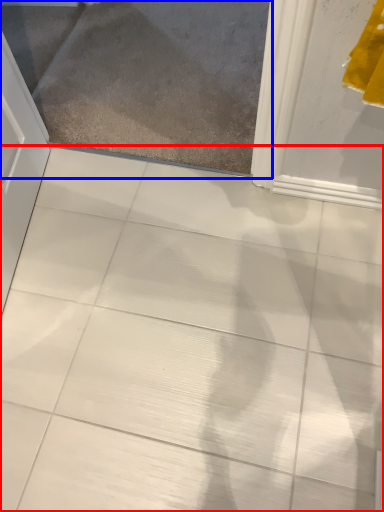
Question: Which of the following is the closest to the observer, ceramic tile (highlighted by a red box) or glass door (highlighted by a blue box)?

Choices:
 (A) ceramic tile
 (B) glass door

Answer: (A)